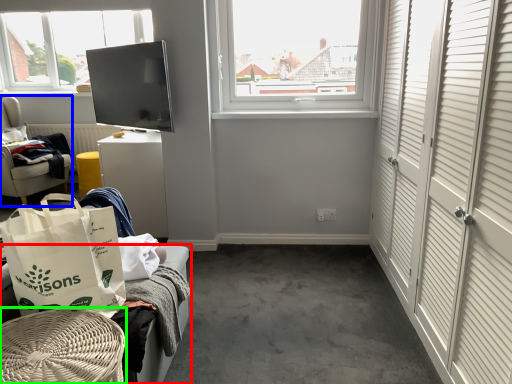
Question: Which object is positioned farthest from furniture (highlighted by a red box)? Select from furniture (highlighted by a blue box) and furniture (highlighted by a green box).

Choices:
 (A) furniture
 (B) furniture

Answer: (A)